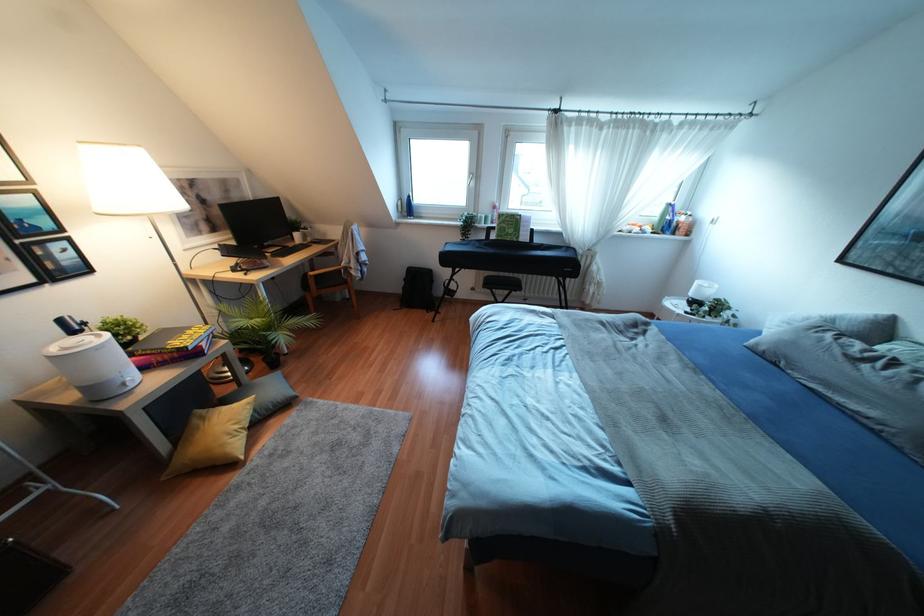
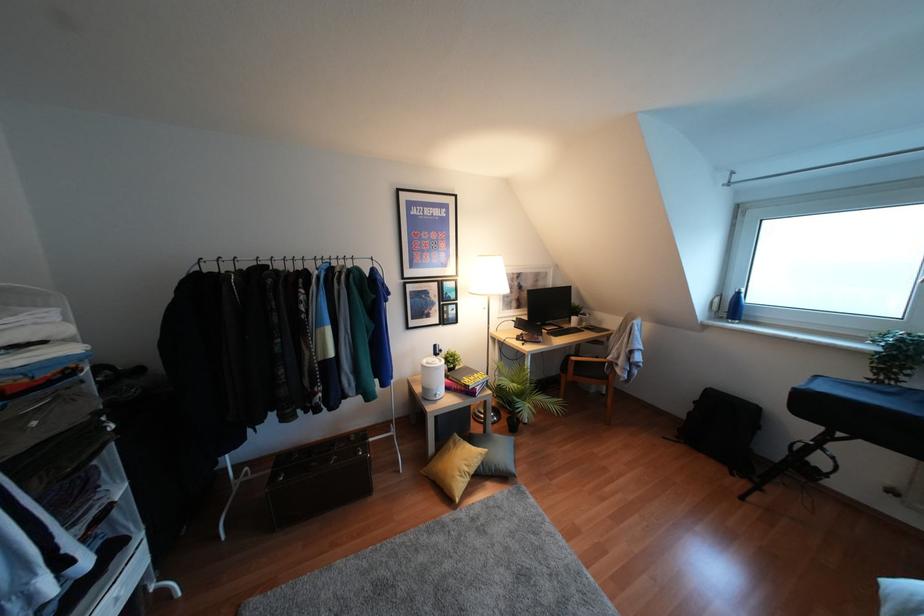
Question: How did the camera likely rotate?

Choices:
 (A) Left
 (B) Right
 (C) Up
 (D) Down

Answer: (A)